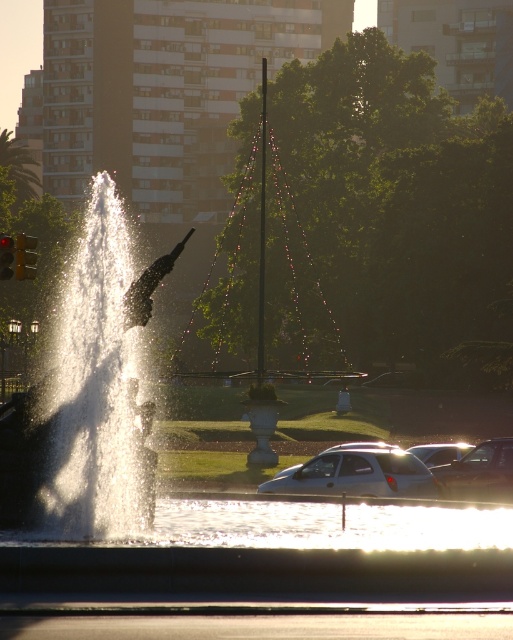
Consider the image. You are a photographer planning to capture the clear water at center and the white matte car at center in the same frame. Based on their sizes in the scene, which object would appear larger in your photo?

The clear water at center is bigger than the white matte car at center, so it would appear larger in the photo.

Consider the image. You are driving a car and see the metallic silver sedan at lower right and the yellow plastic traffic light at left. Which object is positioned to the right side?

The metallic silver sedan at lower right is positioned to the right of the yellow plastic traffic light at left according to the scene description.

From the picture: You are a delivery driver who needs to park your metallic silver sedan at lower right near the yellow plastic traffic light at left. Based on their sizes, can you safely park the sedan without blocking the traffic light?

The metallic silver sedan at lower right is smaller than the yellow plastic traffic light at left, so it should be possible to park the sedan without blocking the traffic light as the sedan takes up less space.